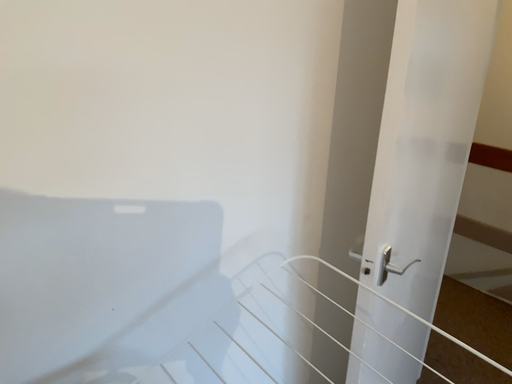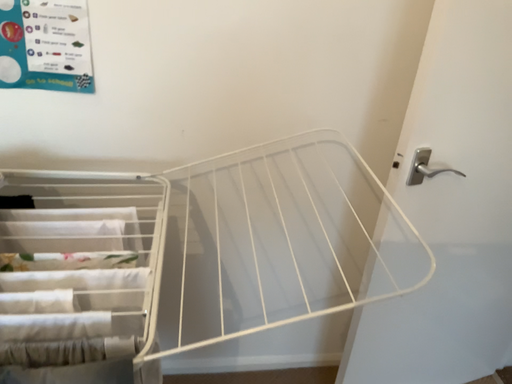
Question: Which way did the camera rotate in the video?

Choices:
 (A) rotated right
 (B) rotated left

Answer: (B)